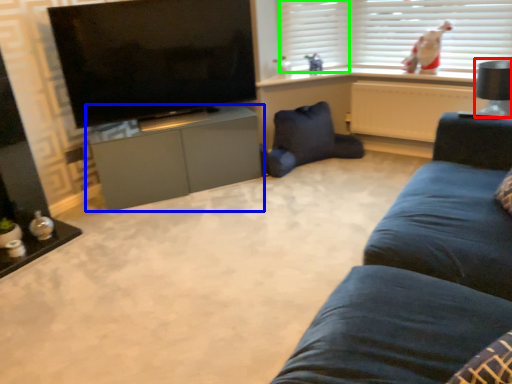
Question: Which object is the closest to the lamp (highlighted by a red box)? Choose among these: cabinetry (highlighted by a blue box) or shutter (highlighted by a green box).

Choices:
 (A) cabinetry
 (B) shutter

Answer: (B)